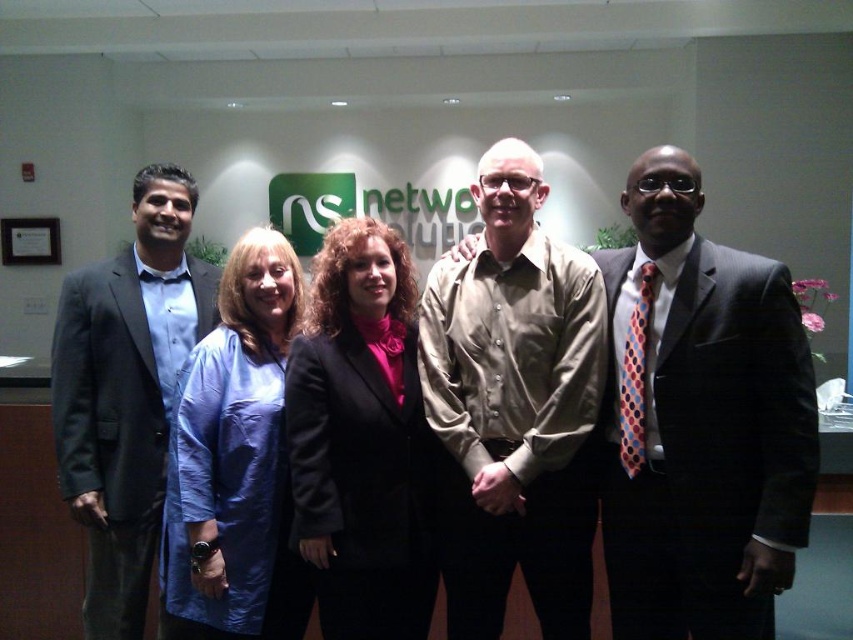
Question: Can you confirm if matte khaki shirt at center is positioned to the left of matte blue suit at left?

Choices:
 (A) no
 (B) yes

Answer: (A)

Question: Based on their relative distances, which object is nearer to the tan cotton shirt at center?

Choices:
 (A) blue fabric coat at center
 (B) matte khaki shirt at center
 (C) matte blue suit at left

Answer: (B)

Question: Which object is positioned farthest from the matte black blazer at center?

Choices:
 (A) tan cotton shirt at center
 (B) matte blue suit at left
 (C) matte khaki shirt at center

Answer: (C)

Question: Is matte khaki shirt at center thinner than matte blue suit at left?

Choices:
 (A) yes
 (B) no

Answer: (A)

Question: Does matte blue suit at left appear on the left side of blue fabric coat at center?

Choices:
 (A) no
 (B) yes

Answer: (B)

Question: Which object is positioned farthest from the matte blue suit at left?

Choices:
 (A) matte black blazer at center
 (B) matte khaki shirt at center
 (C) blue fabric coat at center

Answer: (B)